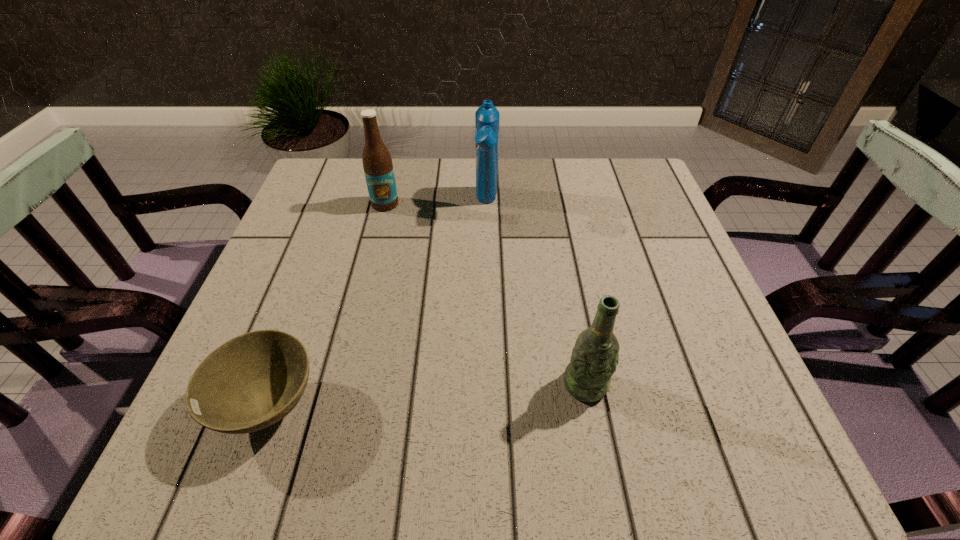
Find the location of a particular element. This screenshot has width=960, height=540. free space between the nearer beer bottle and the left beer bottle is located at coordinates (485, 294).

At what (x,y) coordinates should I click in order to perform the action: click on free spot between the left beer bottle and the shampoo. Please return your answer as a coordinate pair (x, y). This screenshot has height=540, width=960. Looking at the image, I should click on (436, 203).

At what (x,y) coordinates should I click in order to perform the action: click on object that can be found as the third closest to the nearer beer bottle. Please return your answer as a coordinate pair (x, y). The height and width of the screenshot is (540, 960). Looking at the image, I should click on (378, 168).

Point out which object is positioned as the nearest to the bowl. Please provide its 2D coordinates. Your answer should be formatted as a tuple, i.e. [(x, y)], where the tuple contains the x and y coordinates of a point satisfying the conditions above.

[(587, 378)]